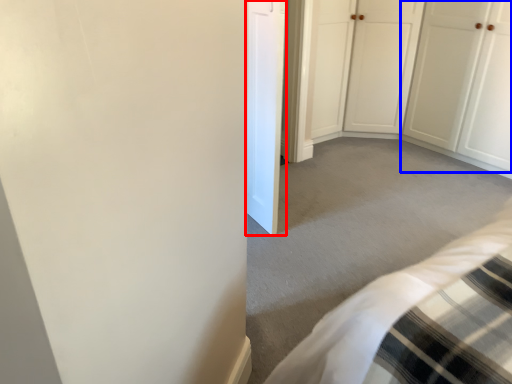
Question: Which point is further to the camera, door (highlighted by a red box) or door (highlighted by a blue box)?

Choices:
 (A) door
 (B) door

Answer: (B)